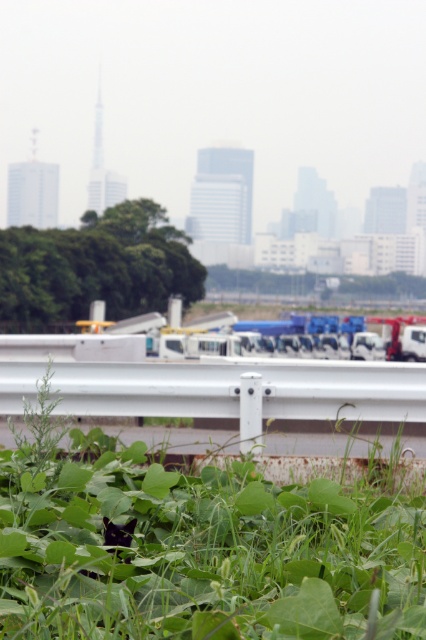
Is green leafy grass at lower center closer to camera compared to green leafy trees at center?

Yes, green leafy grass at lower center is in front of green leafy trees at center.

Does point (120, 509) come behind point (34, 248)?

No, (120, 509) is closer to viewer.

Who is more forward, (271, 608) or (115, 262)?

Point (271, 608) is in front.

This screenshot has height=640, width=426. In order to click on green leafy grass at lower center in this screenshot , I will do (x=199, y=548).